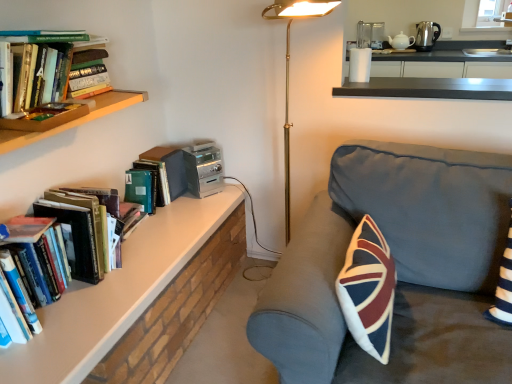
Question: From the image's perspective, is white glossy counter at upper right on hardcover book at upper left, the 1th book viewed from the back?

Choices:
 (A) no
 (B) yes

Answer: (B)

Question: Considering the relative sizes of white glossy counter at upper right and hardcover book at upper left, which appears as the third book when viewed from the front, in the image provided, is white glossy counter at upper right smaller than hardcover book at upper left, which appears as the third book when viewed from the front,?

Choices:
 (A) yes
 (B) no

Answer: (B)

Question: Is white glossy counter at upper right thinner than hardcover book at upper left, the 1th book viewed from the back?

Choices:
 (A) no
 (B) yes

Answer: (A)

Question: Could you tell me if white glossy counter at upper right is facing hardcover book at upper left, which appears as the third book when viewed from the front?

Choices:
 (A) no
 (B) yes

Answer: (A)

Question: Considering the relative sizes of white glossy counter at upper right and hardcover book at upper left, which appears as the third book when viewed from the front, in the image provided, is white glossy counter at upper right wider than hardcover book at upper left, which appears as the third book when viewed from the front,?

Choices:
 (A) yes
 (B) no

Answer: (A)

Question: From a real-world perspective, is white glossy counter at upper right on top of hardcover book at upper left, the 1th book viewed from the back?

Choices:
 (A) yes
 (B) no

Answer: (A)

Question: Does hardcover books at left, the third book from the back, have a greater height compared to hardcover book at upper left, which appears as the third book when viewed from the front?

Choices:
 (A) no
 (B) yes

Answer: (B)

Question: Is hardcover books at left, marked as the first book in a front-to-back arrangement, positioned with its back to hardcover book at upper left, the 1th book viewed from the back?

Choices:
 (A) yes
 (B) no

Answer: (B)

Question: Is hardcover books at left, the third book from the back, not close to hardcover book at upper left, which appears as the third book when viewed from the front?

Choices:
 (A) no
 (B) yes

Answer: (A)

Question: Does hardcover books at left, the third book from the back, have a greater width compared to hardcover book at upper left, the 1th book viewed from the back?

Choices:
 (A) yes
 (B) no

Answer: (A)

Question: From a real-world perspective, is hardcover books at left, the third book from the back, on hardcover book at upper left, which appears as the third book when viewed from the front?

Choices:
 (A) yes
 (B) no

Answer: (A)

Question: From the image's perspective, is hardcover books at left, the third book from the back, below hardcover book at upper left, which appears as the third book when viewed from the front?

Choices:
 (A) yes
 (B) no

Answer: (A)

Question: Considering the relative sizes of white ceramic teapot at upper right, which ranks as the 1th appliance in back-to-front order, and hardcover book at upper left, the 1th book viewed from the back, in the image provided, is white ceramic teapot at upper right, which ranks as the 1th appliance in back-to-front order, wider than hardcover book at upper left, the 1th book viewed from the back,?

Choices:
 (A) no
 (B) yes

Answer: (B)